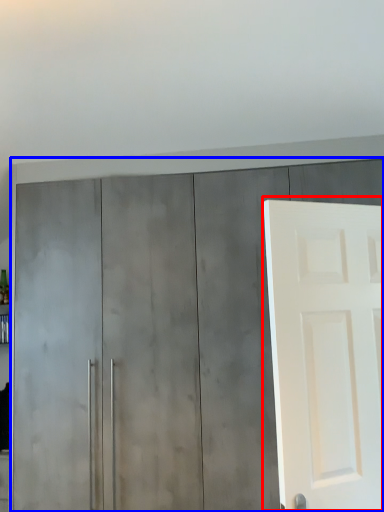
Question: Which of the following is the farthest to the observer, door (highlighted by a red box) or cupboard (highlighted by a blue box)?

Choices:
 (A) door
 (B) cupboard

Answer: (B)